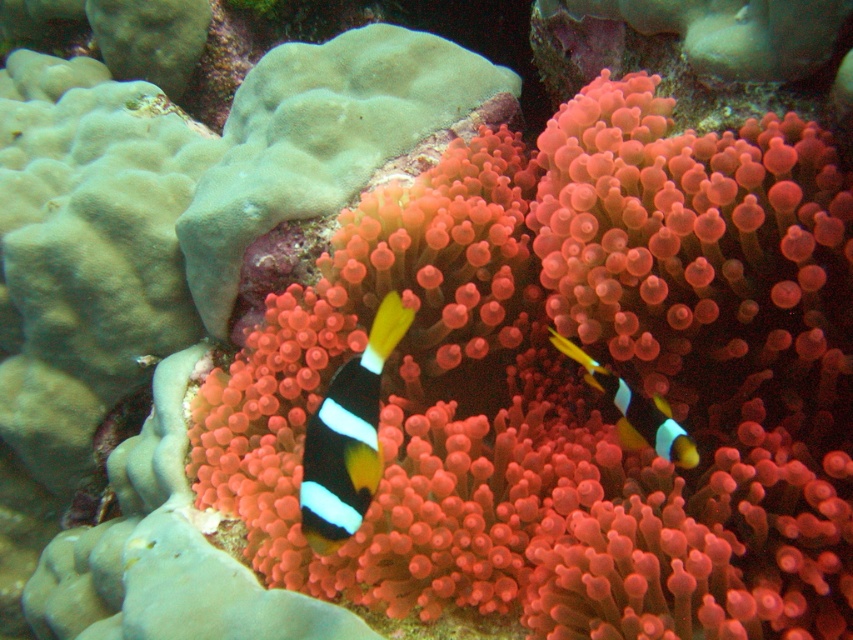
Question: Is black and white striped clownfish at center to the right of black and white striped fish at center from the viewer's perspective?

Choices:
 (A) no
 (B) yes

Answer: (A)

Question: Does black and white striped clownfish at center have a lesser width compared to black and white striped fish at center?

Choices:
 (A) yes
 (B) no

Answer: (A)

Question: Which object is farther from the camera taking this photo?

Choices:
 (A) black and white striped fish at center
 (B) black and white striped clownfish at center

Answer: (A)

Question: Is black and white striped clownfish at center below black and white striped fish at center?

Choices:
 (A) no
 (B) yes

Answer: (B)

Question: Among these objects, which one is farthest from the camera?

Choices:
 (A) black and white striped fish at center
 (B) black and white striped clownfish at center

Answer: (A)

Question: Which object is closer to the camera taking this photo?

Choices:
 (A) black and white striped fish at center
 (B) black and white striped clownfish at center

Answer: (B)